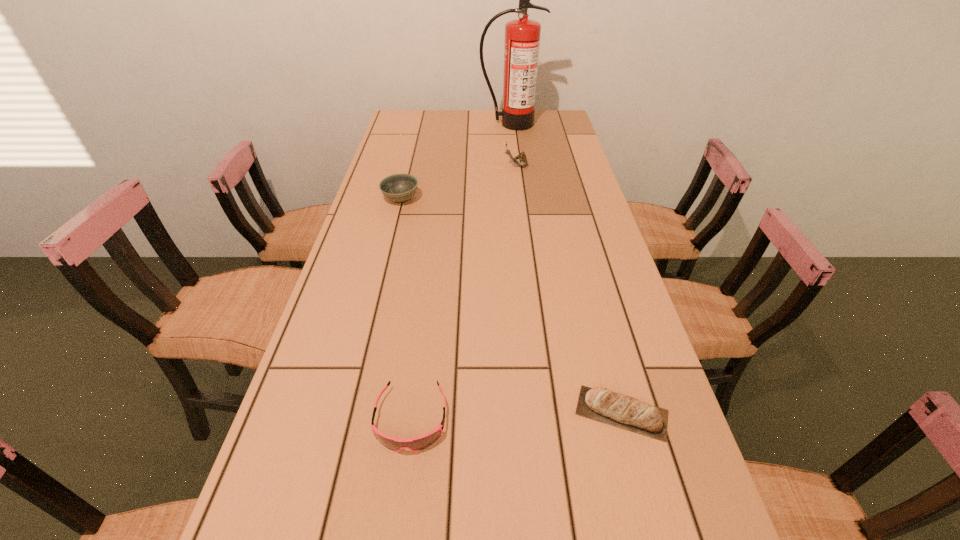
Find the location of a particular element. Image resolution: width=960 pixels, height=540 pixels. vacant space that's between the pita bread and the goggles is located at coordinates (516, 416).

At what (x,y) coordinates should I click in order to perform the action: click on vacant area that lies between the fire extinguisher and the third tallest object. Please return your answer as a coordinate pair (x, y). The image size is (960, 540). Looking at the image, I should click on (456, 161).

I want to click on free space between the fourth shortest object and the bowl, so click(x=459, y=183).

Locate an element on the screen. The width and height of the screenshot is (960, 540). vacant space that's between the third farthest object and the pita bread is located at coordinates (511, 306).

I want to click on free space between the farthest object and the bowl, so click(456, 161).

At what (x,y) coordinates should I click in order to perform the action: click on object that is the closest to the fourth shortest object. Please return your answer as a coordinate pair (x, y). The image size is (960, 540). Looking at the image, I should click on (522, 36).

The width and height of the screenshot is (960, 540). In order to click on the fourth closest object to the pita bread in this screenshot , I will do `click(522, 36)`.

At what (x,y) coordinates should I click in order to perform the action: click on vacant position in the image that satisfies the following two spatial constraints: 1. on the face of the fourth shortest object; 2. on the front-facing side of the goggles. Please return your answer as a coordinate pair (x, y). Looking at the image, I should click on (548, 419).

Where is `vacant region that satisfies the following two spatial constraints: 1. on the face of the fourth nearest object; 2. on the back side of the pita bread`? vacant region that satisfies the following two spatial constraints: 1. on the face of the fourth nearest object; 2. on the back side of the pita bread is located at coordinates (547, 413).

In order to click on vacant space that satisfies the following two spatial constraints: 1. on the front-facing side of the pita bread; 2. on the right side of the farthest object in this screenshot , I will do `click(546, 413)`.